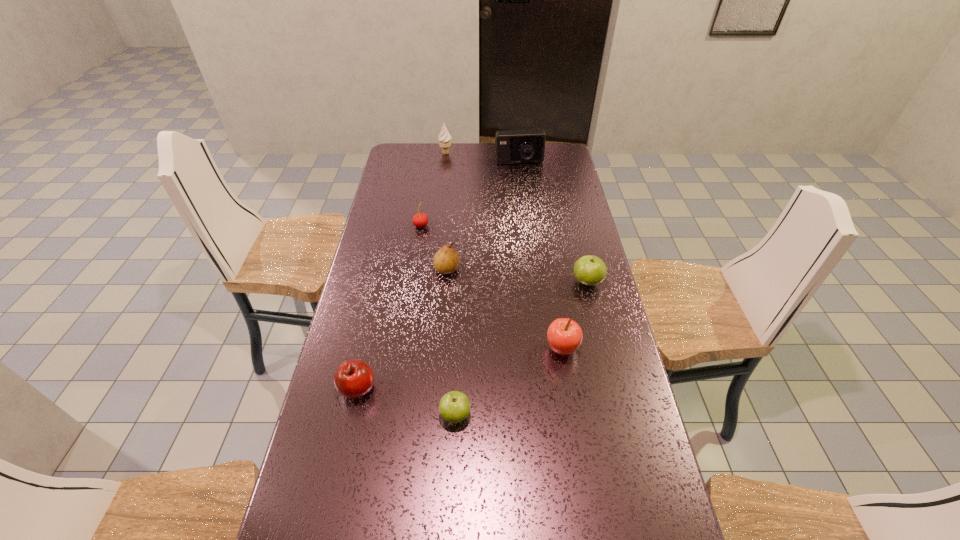
In order to click on red cherry in this screenshot , I will do `click(420, 220)`.

Locate an element on the screen. The image size is (960, 540). cherry is located at coordinates (420, 220).

Locate an element on the screen. This screenshot has height=540, width=960. the third apple from right to left is located at coordinates (454, 407).

You are a GUI agent. You are given a task and a screenshot of the screen. Output one action in this format:
    pyautogui.click(x=<x>, y=<y>)
    Task: Click on the smaller green apple
    
    Given the screenshot: What is the action you would take?
    pyautogui.click(x=454, y=407)

Where is `blank space located 0.330m on the front-facing side of the farthest object`? The height and width of the screenshot is (540, 960). blank space located 0.330m on the front-facing side of the farthest object is located at coordinates (x=522, y=153).

This screenshot has width=960, height=540. In order to click on vacant point located 0.370m on the front-facing side of the seventh nearest object in this screenshot , I will do `click(526, 219)`.

Identify the location of vacant area situated on the right of the pear. (518, 269).

Find the location of a particular element. The width and height of the screenshot is (960, 540). vacant area located on the front of the right green apple is located at coordinates (599, 330).

This screenshot has height=540, width=960. Identify the location of vacant area situated 0.080m on the right of the third nearest apple. (606, 349).

Find the location of a particular element. blank space located on the right of the leftmost object is located at coordinates (479, 388).